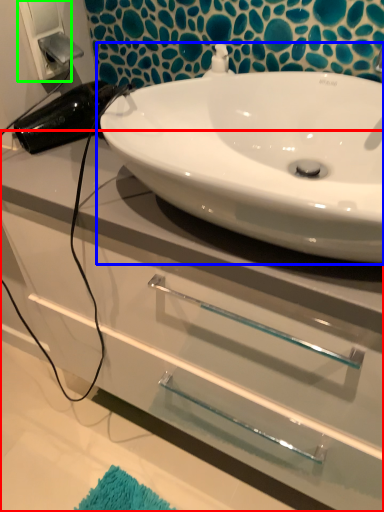
Question: Considering the real-world distances, which object is farthest from bathroom cabinet (highlighted by a red box)? sink (highlighted by a blue box) or electric outlet (highlighted by a green box)?

Choices:
 (A) sink
 (B) electric outlet

Answer: (B)